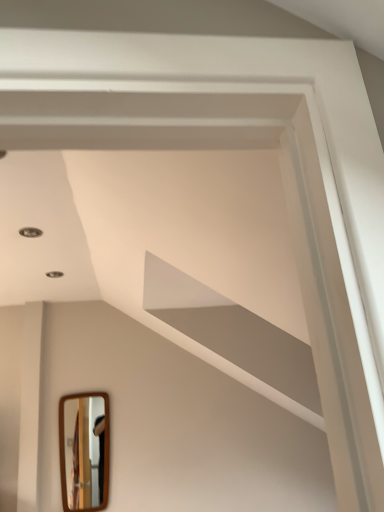
You are a GUI agent. You are given a task and a screenshot of the screen. Output one action in this format:
    pyautogui.click(x=<x>, y=<y>)
    Task: Click on the wooden mirror at lower left
    The image size is (384, 512).
    Given the screenshot: What is the action you would take?
    pyautogui.click(x=84, y=451)

What do you see at coordinates (84, 451) in the screenshot? The width and height of the screenshot is (384, 512). I see `wooden mirror at lower left` at bounding box center [84, 451].

Where is `wooden mirror at lower left`? wooden mirror at lower left is located at coordinates coord(84,451).